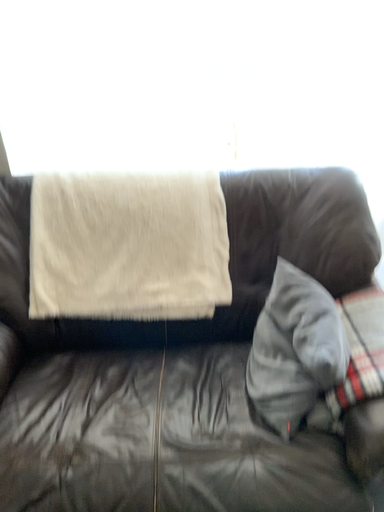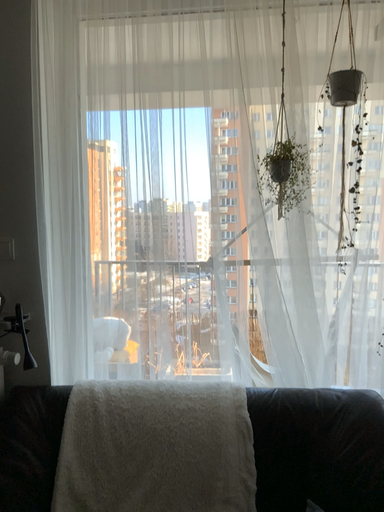
Question: How did the camera likely rotate when shooting the video?

Choices:
 (A) rotated downward
 (B) rotated upward

Answer: (B)